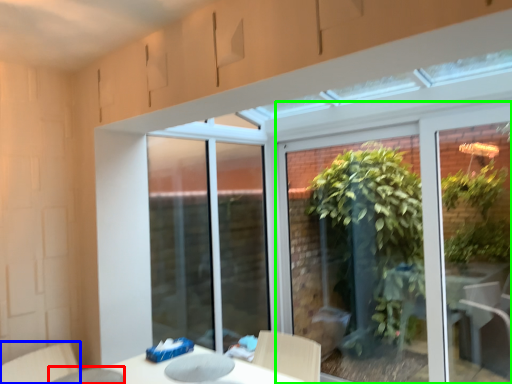
Question: Based on their relative distances, which object is farther from glass table (highlighted by a red box)? Choose from swivel chair (highlighted by a blue box) and window (highlighted by a green box).

Choices:
 (A) swivel chair
 (B) window

Answer: (B)